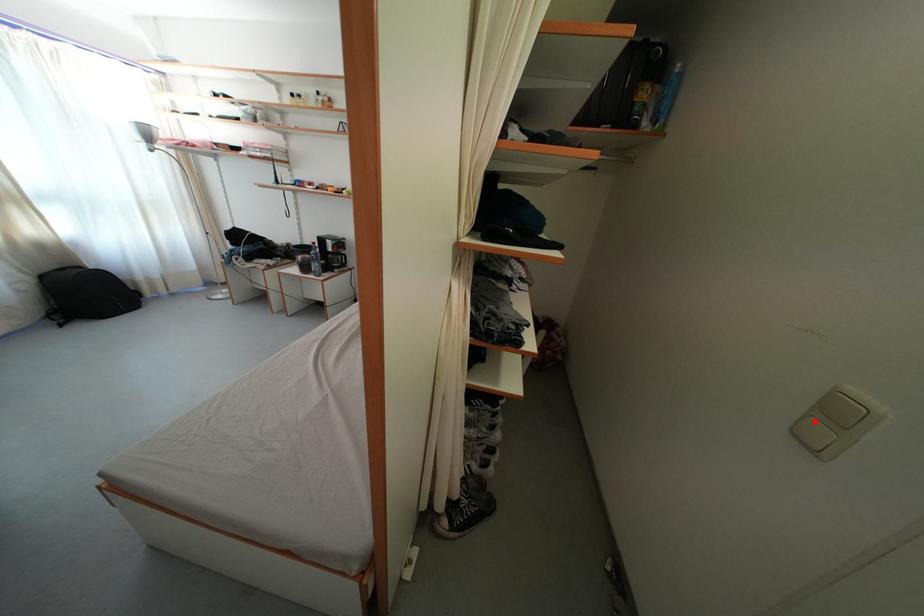
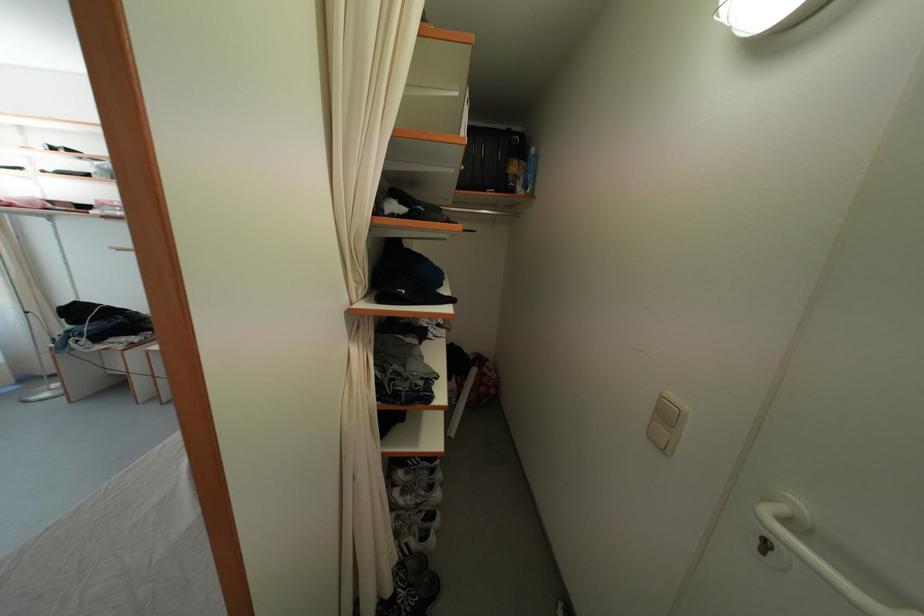
Where in the second image is the point corresponding to the highlighted location from the first image?

(659, 426)